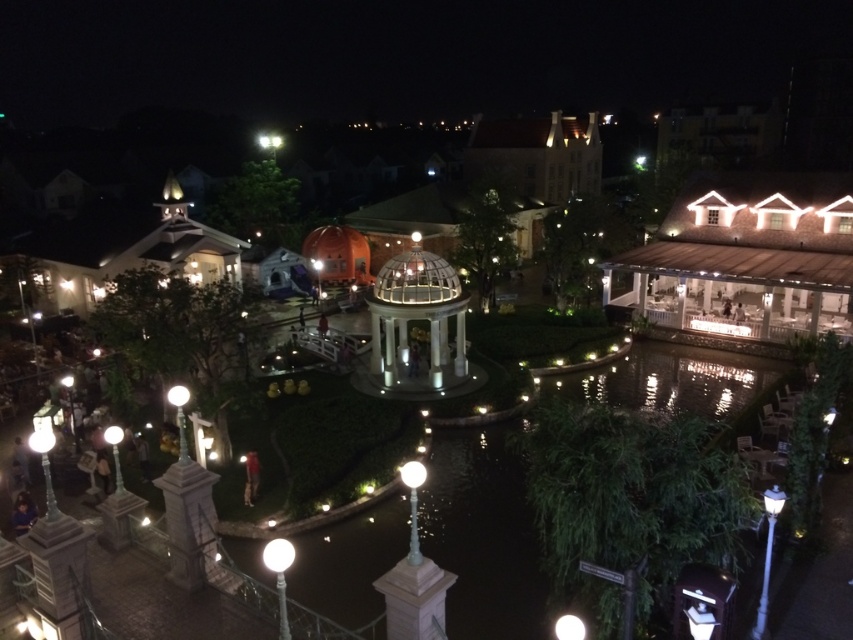
Question: Considering the relative positions of clear water at center and white glass gazebo at center in the image provided, where is clear water at center located with respect to white glass gazebo at center?

Choices:
 (A) left
 (B) right

Answer: (B)

Question: Does clear water at center have a larger size compared to white glass gazebo at center?

Choices:
 (A) no
 (B) yes

Answer: (B)

Question: Which of the following is the closest to the observer?

Choices:
 (A) white glass gazebo at center
 (B) clear water at center

Answer: (B)

Question: Observing the image, what is the correct spatial positioning of clear water at center in reference to white glass gazebo at center?

Choices:
 (A) left
 (B) right

Answer: (B)

Question: Which of the following is the farthest from the observer?

Choices:
 (A) (784, 380)
 (B) (426, 250)

Answer: (B)